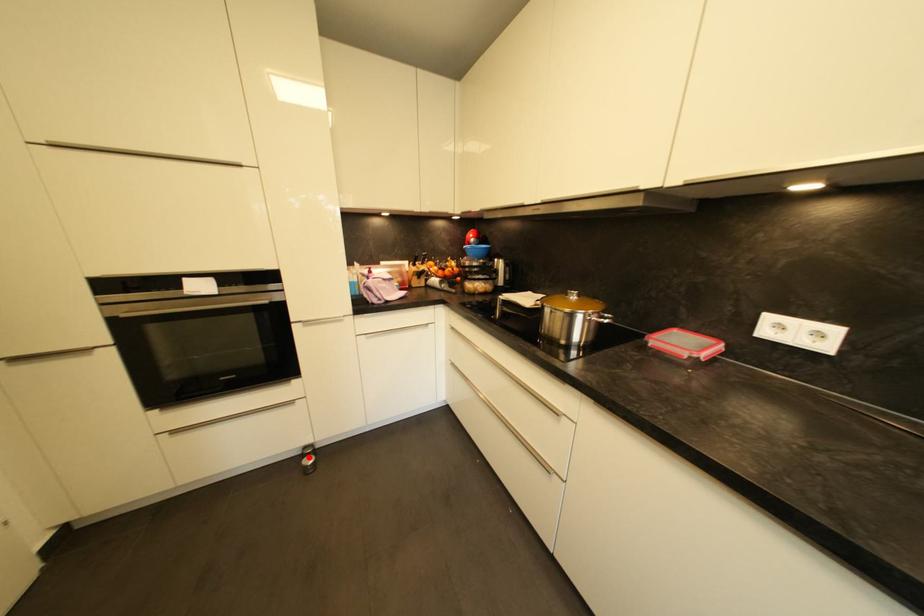
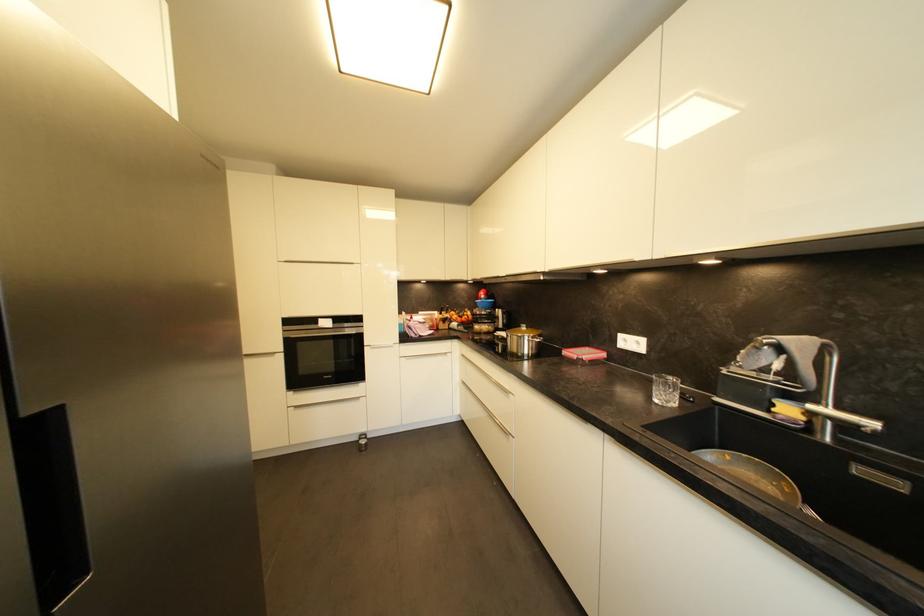
Question: I am providing you with two images of the same scene from different viewpoints. In image1, a red point is highlighted. Considering the same 3D point in image2, which of the following is correct?

Choices:
 (A) It is closer
 (B) It is farther

Answer: (B)